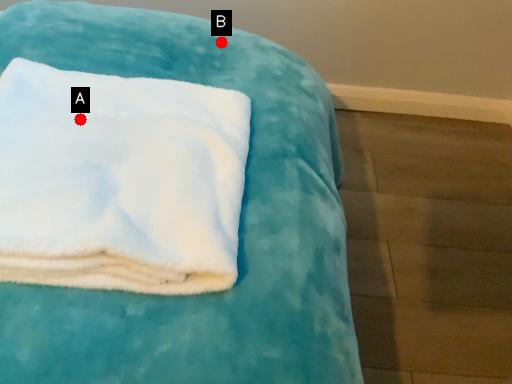
Question: Two points are circled on the image, labeled by A and B beside each circle. Which point appears closest to the camera in this image?

Choices:
 (A) A is closer
 (B) B is closer

Answer: (A)